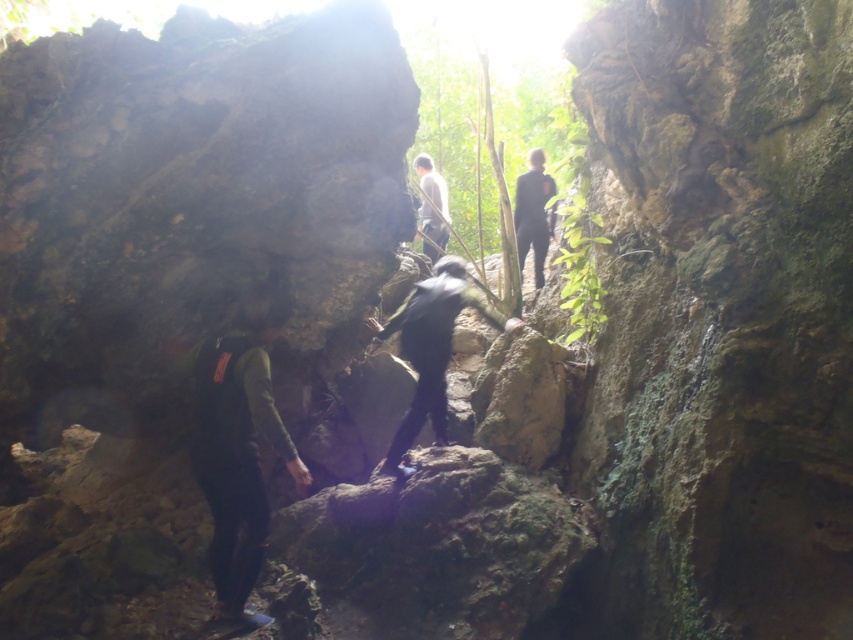
You are part of a hiking group in a rocky cave. You see a dark green fabric backpack at lower left and a dark gray fabric jacket at center. Which object is located more to the left?

The dark green fabric backpack at lower left is more to the left than the dark gray fabric jacket at center.

You are exploring a cave and see two points marked on your map. The first point is at coordinates point (231,397) and the second is at point (432,298). Which point is closer to you if you are facing the cave entrance?

Point (231,397) is in front of point (432,298), so it is closer to you when facing the cave entrance.